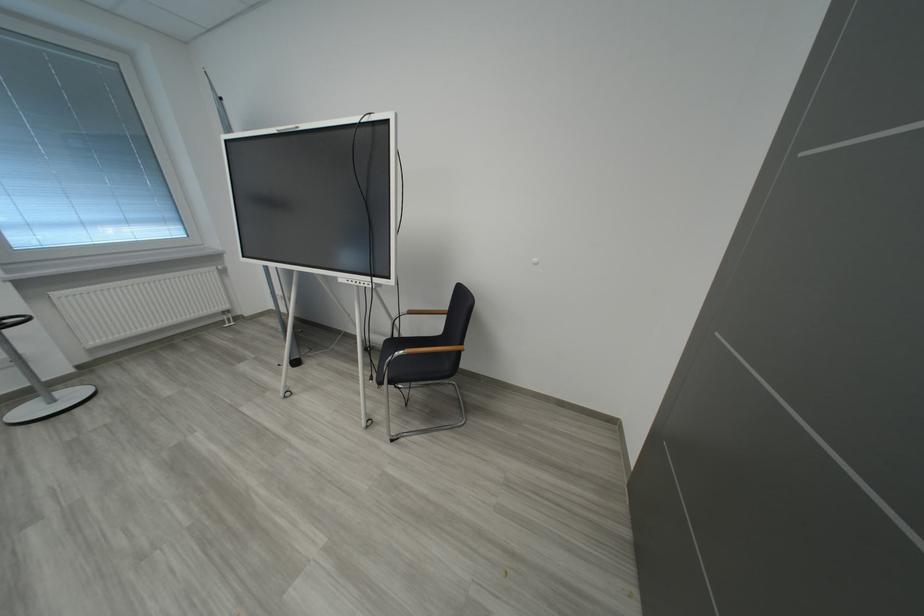
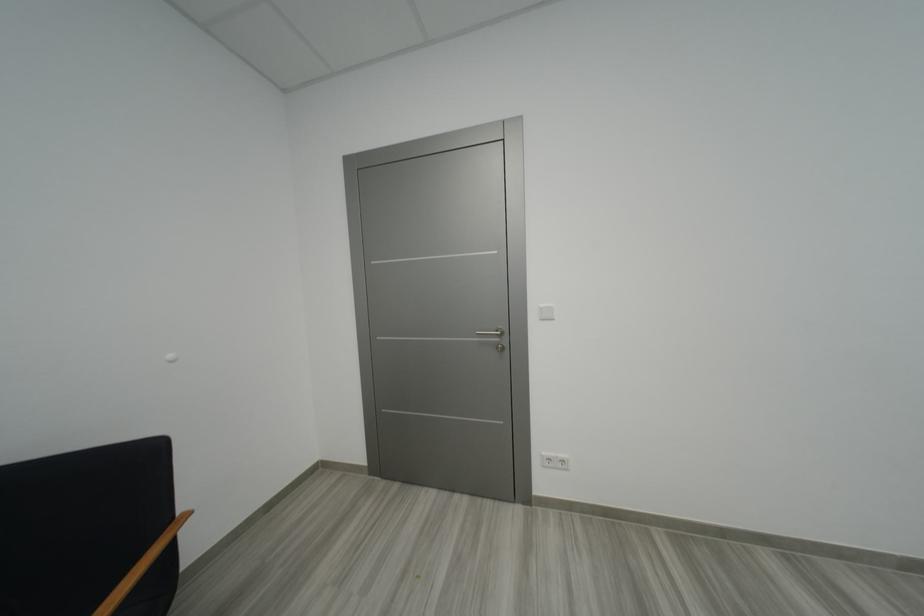
Question: The images are taken continuously from a first-person perspective. In which direction is your viewpoint rotating?

Choices:
 (A) Left
 (B) Right
 (C) Up
 (D) Down

Answer: (B)